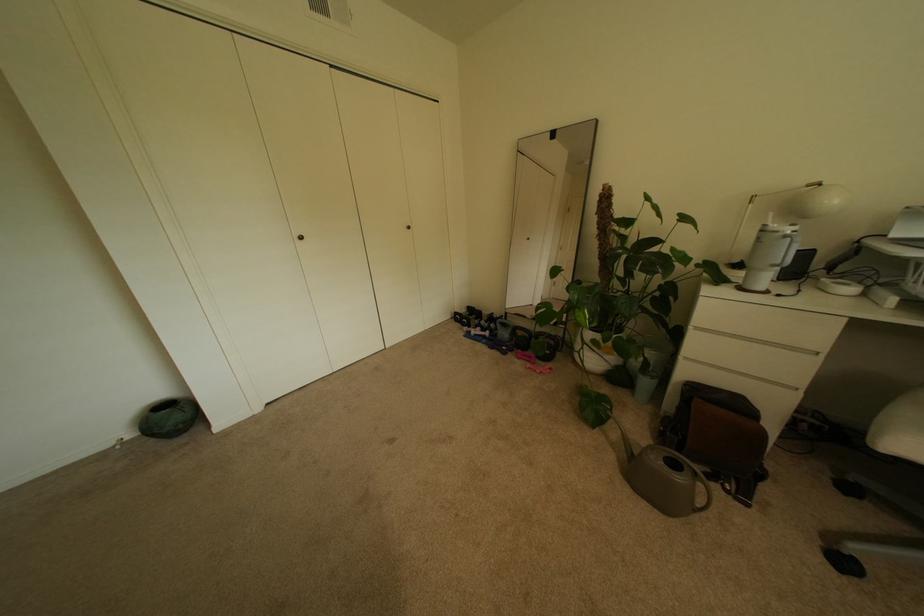
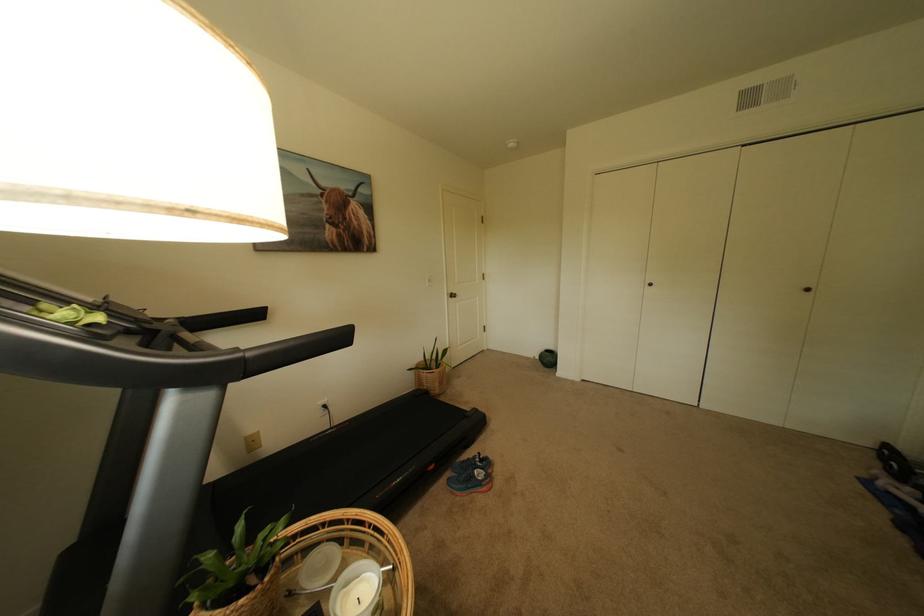
Question: The first image is from the beginning of the video and the second image is from the end. How did the camera likely rotate when shooting the video?

Choices:
 (A) Left
 (B) Right
 (C) Up
 (D) Down

Answer: (A)